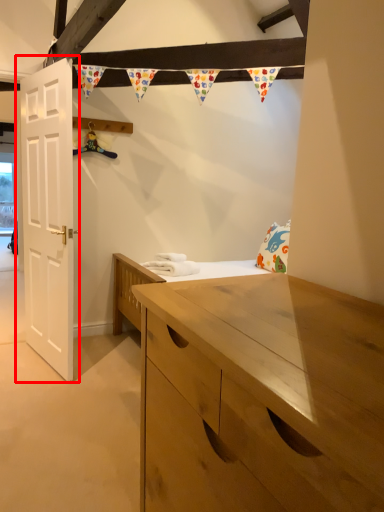
Question: From the image's perspective, where is door (annotated by the red box) located in relation to laundry in the image?

Choices:
 (A) below
 (B) above

Answer: (B)